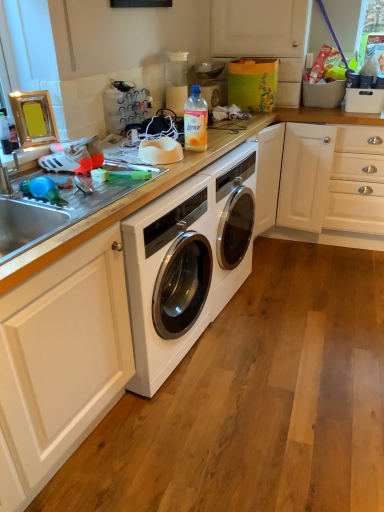
The image size is (384, 512). What are the coordinates of `white glossy countertop at center` in the screenshot? It's located at (126, 204).

From a real-world perspective, is white glossy countertop at center above or below translucent plastic bottle at center?

white glossy countertop at center is below translucent plastic bottle at center.

Is white glossy countertop at center bigger or smaller than translucent plastic bottle at center?

white glossy countertop at center is bigger than translucent plastic bottle at center.

Are white glossy countertop at center and translucent plastic bottle at center far apart?

Actually, white glossy countertop at center and translucent plastic bottle at center are a little close together.

Which is more distant, (239, 122) or (192, 142)?

Positioned behind is point (239, 122).

Can you tell me how much matte white cabinet at upper right and white glossy countertop at center differ in facing direction?

There is a 84-degree angle between the facing directions of matte white cabinet at upper right and white glossy countertop at center.

Which is in front, point (250, 16) or point (243, 132)?

The point (243, 132) is more forward.

From the image's perspective, between matte white cabinet at upper right and white glossy countertop at center, who is located below?

white glossy countertop at center appears lower in the image.

Would you say matte white cabinet at upper right is a long distance from white glossy countertop at center?

That's not correct — matte white cabinet at upper right is a little close to white glossy countertop at center.

Visually, is translucent plastic bottle at center positioned to the left or to the right of white glossy countertop at center?

translucent plastic bottle at center is positioned on white glossy countertop at center's right side.

From a real-world perspective, is translucent plastic bottle at center positioned above or below white glossy countertop at center?

translucent plastic bottle at center is above white glossy countertop at center.

Is the depth of translucent plastic bottle at center greater than that of white glossy countertop at center?

No.

The image size is (384, 512). In the image, there is a matte white cabinet at upper right. Find the location of `bottle below it (from a real-world perspective)`. bottle below it (from a real-world perspective) is located at coordinates (195, 121).

From the image's perspective, which is above, translucent plastic bottle at center or matte white cabinet at upper right?

From the image's view, matte white cabinet at upper right is above.

How different are the orientations of translucent plastic bottle at center and matte white cabinet at upper right in degrees?

translucent plastic bottle at center and matte white cabinet at upper right are facing 6.52 degrees away from each other.

Is point (191, 124) closer or farther from the camera than point (269, 19)?

Point (191, 124).

Locate an element on the screen. Image resolution: width=384 pixels, height=512 pixels. cabinetry located above the white glossy countertop at center (from the image's perspective) is located at coordinates (265, 37).

From a real-world perspective, is white glossy countertop at center on top of matte white cabinet at upper right?

No, from a real-world perspective, white glossy countertop at center is not above matte white cabinet at upper right.

Is white glossy countertop at center facing towards matte white cabinet at upper right?

No, white glossy countertop at center is not facing towards matte white cabinet at upper right.

Does white glossy countertop at center have a smaller size compared to matte white cabinet at upper right?

No.

From a real-world perspective, is matte white cabinet at upper right on translucent plastic bottle at center?

Correct, in the physical world, matte white cabinet at upper right is higher than translucent plastic bottle at center.

Which of these two, matte white cabinet at upper right or translucent plastic bottle at center, is thinner?

Thinner between the two is translucent plastic bottle at center.

In the image, is matte white cabinet at upper right positioned in front of or behind translucent plastic bottle at center?

In the image, matte white cabinet at upper right appears behind translucent plastic bottle at center.

Is matte white cabinet at upper right bigger or smaller than translucent plastic bottle at center?

matte white cabinet at upper right is bigger than translucent plastic bottle at center.

At what (x,y) coordinates should I click in order to perform the action: click on bottle above the white glossy countertop at center (from a real-world perspective). Please return your answer as a coordinate pair (x, y). Looking at the image, I should click on (195, 121).

The image size is (384, 512). I want to click on counter top in front of the matte white cabinet at upper right, so click(126, 204).

Looking at the image, which one is located further to matte white cabinet at upper right, translucent plastic bottle at center or white glossy countertop at center?

The object further to matte white cabinet at upper right is translucent plastic bottle at center.

When comparing their distances from matte white cabinet at upper right, does white glossy countertop at center or translucent plastic bottle at center seem closer?

The object closer to matte white cabinet at upper right is white glossy countertop at center.

Considering their positions, is matte white cabinet at upper right positioned closer to white glossy countertop at center than translucent plastic bottle at center?

translucent plastic bottle at center lies closer to white glossy countertop at center than the other object.

Considering their positions, is white glossy countertop at center positioned further to translucent plastic bottle at center than matte white cabinet at upper right?

matte white cabinet at upper right is further to translucent plastic bottle at center.

Looking at the image, which one is located closer to translucent plastic bottle at center, matte white cabinet at upper right or white glossy countertop at center?

Based on the image, white glossy countertop at center appears to be nearer to translucent plastic bottle at center.

Considering their positions, is translucent plastic bottle at center positioned further to white glossy countertop at center than matte white cabinet at upper right?

matte white cabinet at upper right lies further to white glossy countertop at center than the other object.

Where is `bottle that lies between matte white cabinet at upper right and white glossy countertop at center from top to bottom`? The width and height of the screenshot is (384, 512). bottle that lies between matte white cabinet at upper right and white glossy countertop at center from top to bottom is located at coordinates (195, 121).